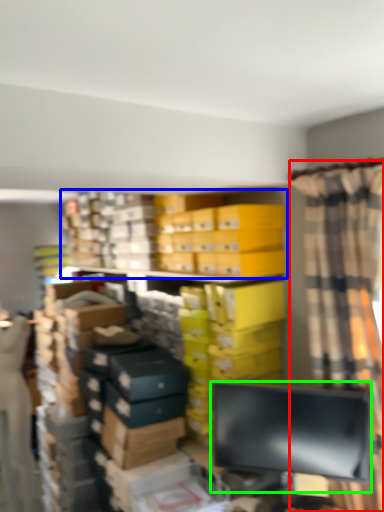
Question: Which object is positioned farthest from curtain (highlighted by a red box)? Select from bookcase (highlighted by a blue box) and computer monitor (highlighted by a green box).

Choices:
 (A) bookcase
 (B) computer monitor

Answer: (A)